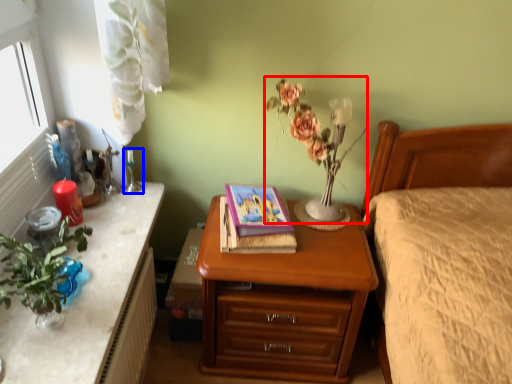
Question: Which object appears closest to the camera in this image, floral arrangement (highlighted by a red box) or candle holder (highlighted by a blue box)?

Choices:
 (A) floral arrangement
 (B) candle holder

Answer: (A)